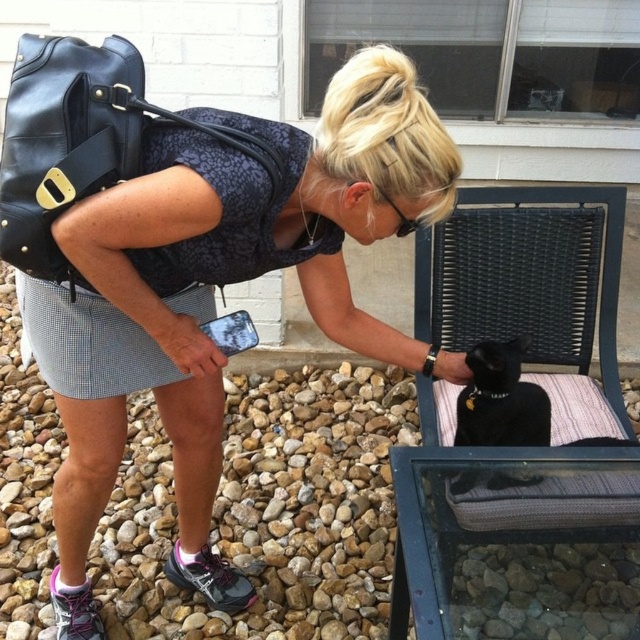
Question: Which object appears farthest from the camera in this image?

Choices:
 (A) matte black purse at upper left
 (B) black woven fabric folding chair at lower right
 (C) black matte fur cat at lower right

Answer: (B)

Question: Does matte black purse at upper left have a smaller size compared to black woven fabric folding chair at lower right?

Choices:
 (A) no
 (B) yes

Answer: (A)

Question: Which of the following is the farthest from the observer?

Choices:
 (A) black woven fabric folding chair at lower right
 (B) black matte fur cat at lower right

Answer: (A)

Question: Does matte black purse at upper left appear on the right side of black woven fabric folding chair at lower right?

Choices:
 (A) no
 (B) yes

Answer: (A)

Question: Which point appears closest to the camera in this image?

Choices:
 (A) pos(582,204)
 (B) pos(524,413)
 (C) pos(33,285)

Answer: (C)

Question: Can you confirm if matte black purse at upper left is positioned to the right of black matte fur cat at lower right?

Choices:
 (A) yes
 (B) no

Answer: (B)